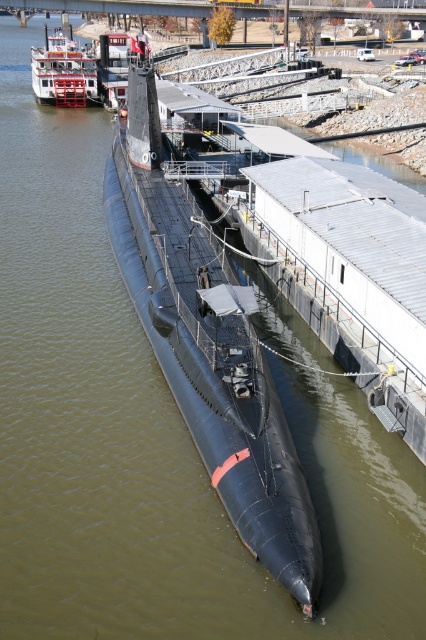
Is point (187, 282) closer to camera compared to point (40, 52)?

Yes.

Is black rubber submarine at center in front of red painted wood paddlewheel boat at upper left?

That is True.

Does point (227, 378) come behind point (60, 48)?

No, (227, 378) is in front of (60, 48).

The height and width of the screenshot is (640, 426). Find the location of `black rubber submarine at center`. black rubber submarine at center is located at coordinates (209, 348).